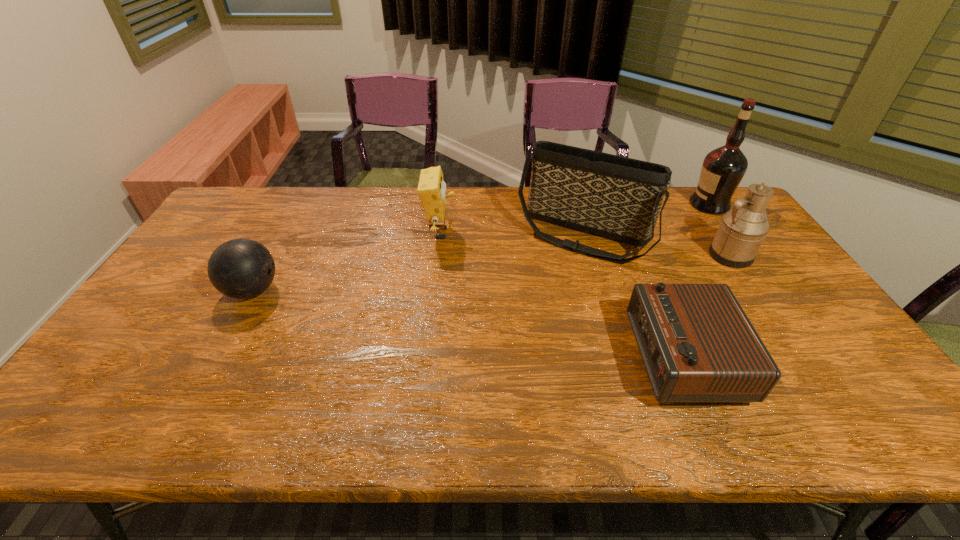
Locate an element on the screen. The height and width of the screenshot is (540, 960). liquor is located at coordinates (722, 170).

Where is `handbag`? The image size is (960, 540). handbag is located at coordinates (612, 196).

This screenshot has height=540, width=960. I want to click on pitcher, so click(x=742, y=230).

In order to click on sponge in this screenshot , I will do `click(431, 189)`.

Locate an element on the screen. This screenshot has width=960, height=540. the second object from left to right is located at coordinates (431, 189).

I want to click on the leftmost object, so click(x=241, y=268).

Where is `bowling ball`? This screenshot has height=540, width=960. bowling ball is located at coordinates (241, 268).

The height and width of the screenshot is (540, 960). In order to click on radio receiver in this screenshot , I will do `click(697, 344)`.

You are a GUI agent. You are given a task and a screenshot of the screen. Output one action in this format:
    pyautogui.click(x=<x>, y=<y>)
    Task: Click on the free space located on the surface of the liquor
    This screenshot has height=540, width=960.
    Given the screenshot: What is the action you would take?
    pyautogui.click(x=671, y=205)

Image resolution: width=960 pixels, height=540 pixels. In order to click on vacant area situated on the surface of the liquor in this screenshot , I will do click(662, 205).